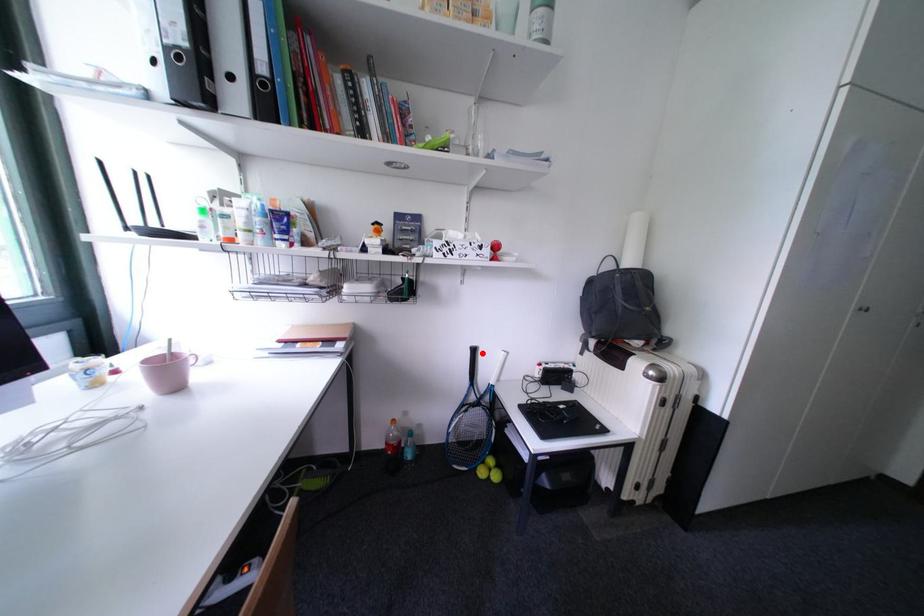
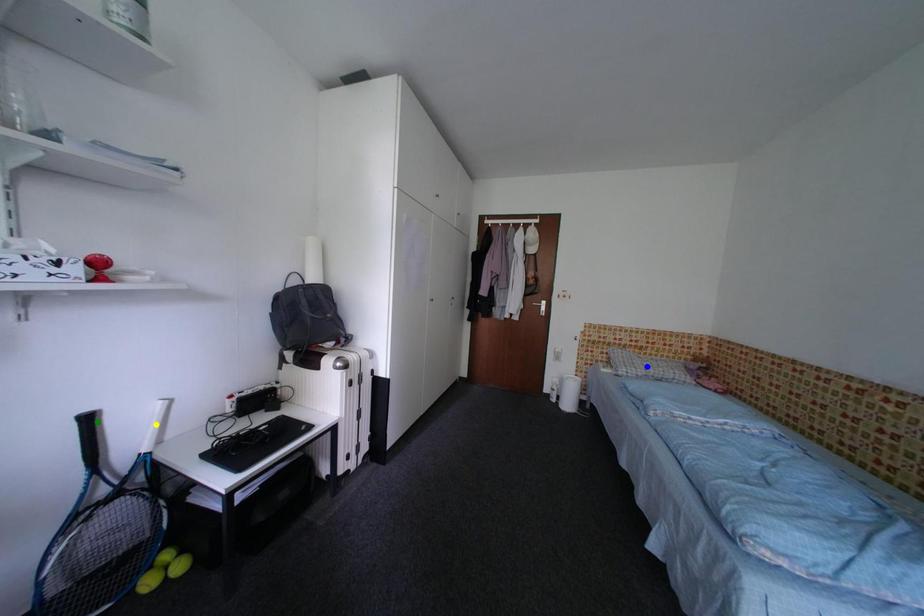
Question: I am providing you with two images of the same scene from different viewpoints. A red point is marked on the first image. You are given multiple points on the second image. Can you choose the point in image 2 that corresponds to the point in image 1?

Choices:
 (A) yellow point
 (B) green point
 (C) blue point

Answer: (B)